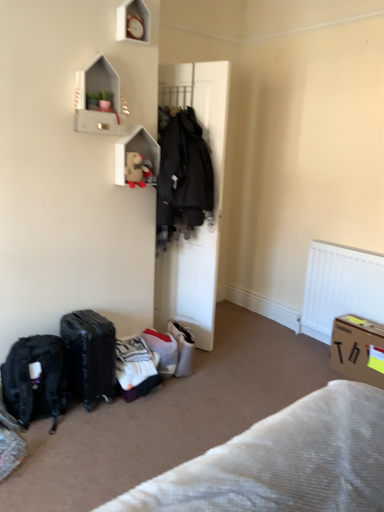
At what (x,y) coordinates should I click in order to perform the action: click on vacant area that is in front of black matte suitcase at lower left. Please return your answer as a coordinate pair (x, y). Looking at the image, I should click on (91, 425).